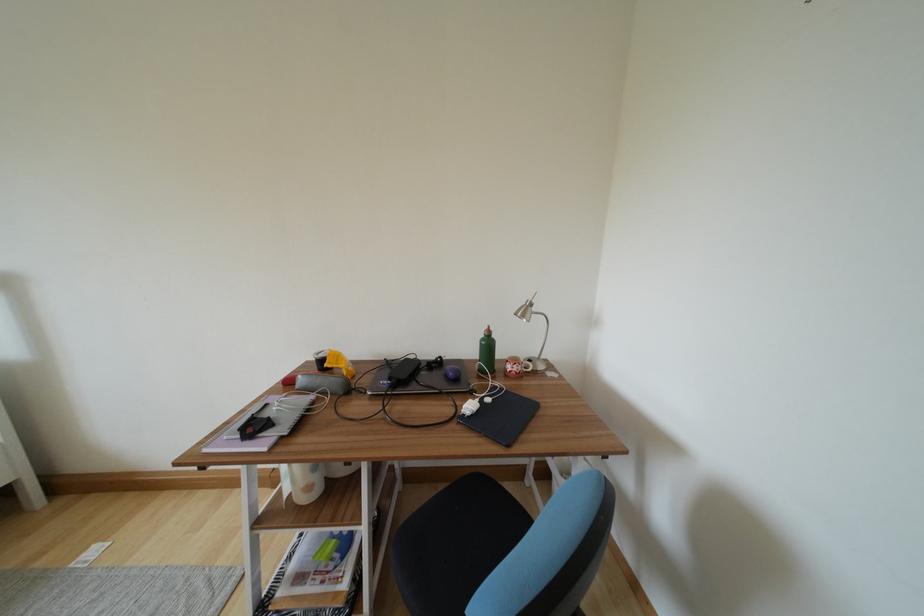
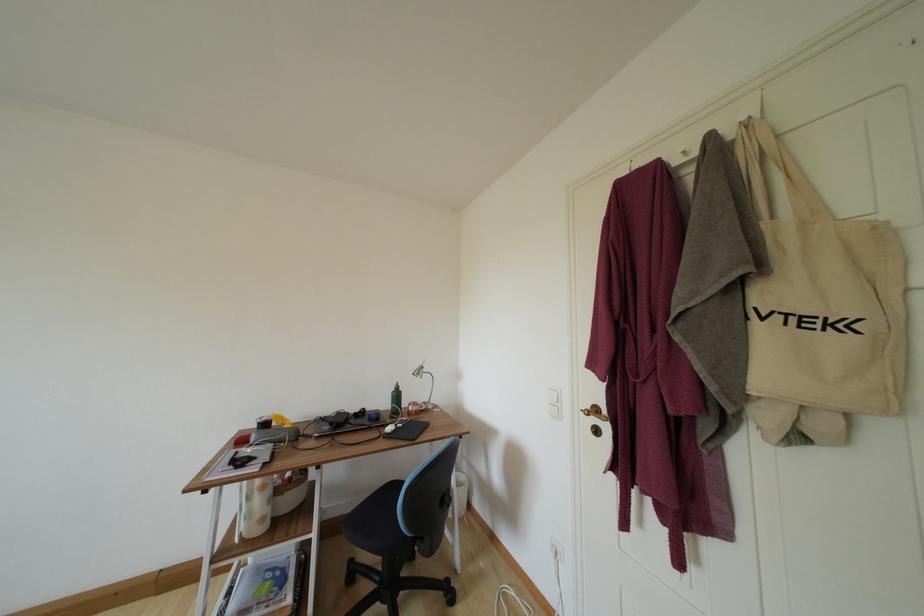
Locate, in the second image, the point that corresponds to point 540,313 in the first image.

(430, 374)